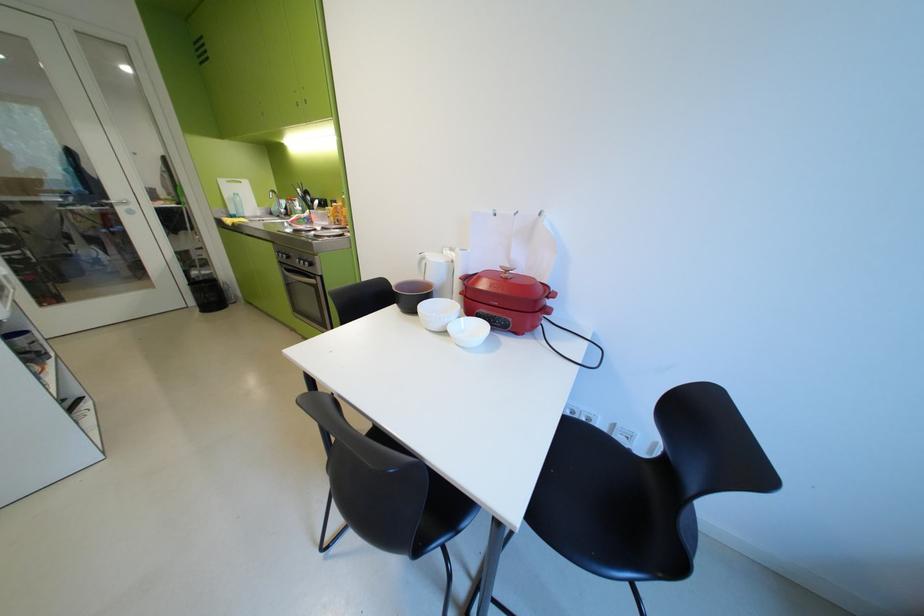
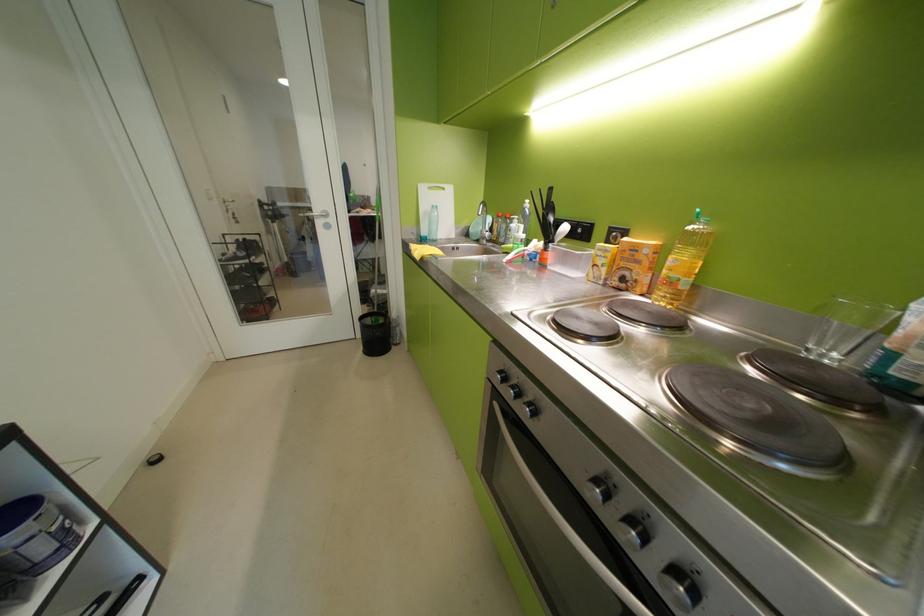
Where in the second image is the point corresponding to (x=233, y=183) from the first image?

(433, 190)